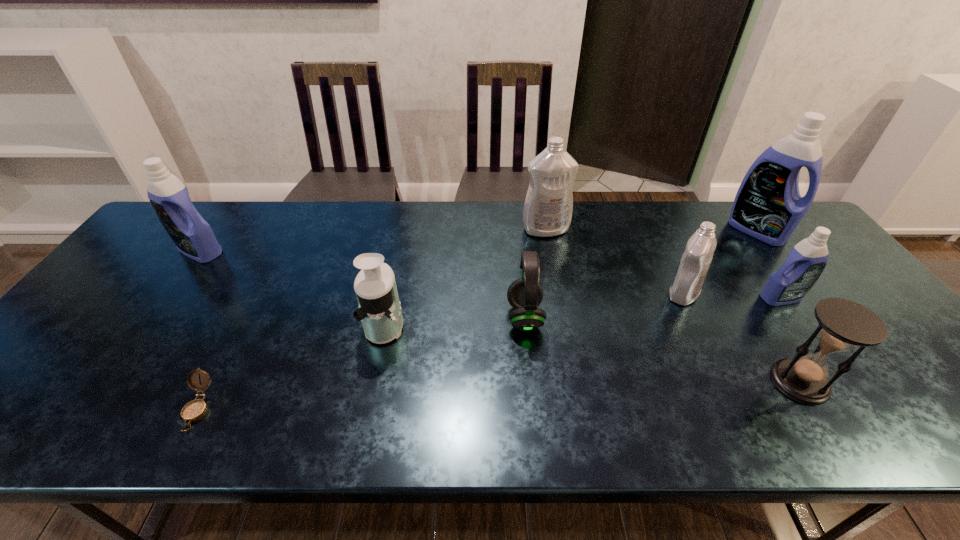
Find the location of a particular element. black hourglass is located at coordinates click(843, 324).

Locate an element on the screen. headset is located at coordinates (525, 294).

I want to click on the shortest object, so click(x=194, y=410).

Where is `compass`? The width and height of the screenshot is (960, 540). compass is located at coordinates (194, 410).

The width and height of the screenshot is (960, 540). Find the location of `vacant space located 0.310m on the front of the biggest blue detergent`. vacant space located 0.310m on the front of the biggest blue detergent is located at coordinates (828, 326).

Find the location of a particular element. blank space located 0.100m on the front of the farther white detergent is located at coordinates (551, 260).

Locate an element on the screen. vacant space located on the back of the second smallest blue detergent is located at coordinates (234, 204).

At what (x,y) coordinates should I click in order to perform the action: click on free space located 0.110m on the front of the juicer. Please return your answer as a coordinate pair (x, y). Image resolution: width=960 pixels, height=540 pixels. Looking at the image, I should click on (372, 389).

This screenshot has width=960, height=540. Find the location of `vacant area located 0.250m on the back of the right white detergent`. vacant area located 0.250m on the back of the right white detergent is located at coordinates (652, 227).

The height and width of the screenshot is (540, 960). Identify the location of blank area located on the right of the smallest blue detergent. (844, 298).